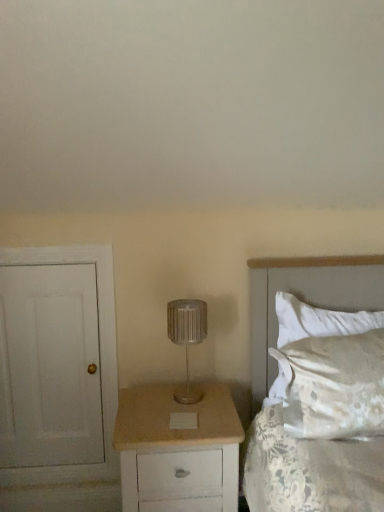
Locate an element on the screen. The width and height of the screenshot is (384, 512). vacant space in front of silver metallic lamp at center is located at coordinates (187, 414).